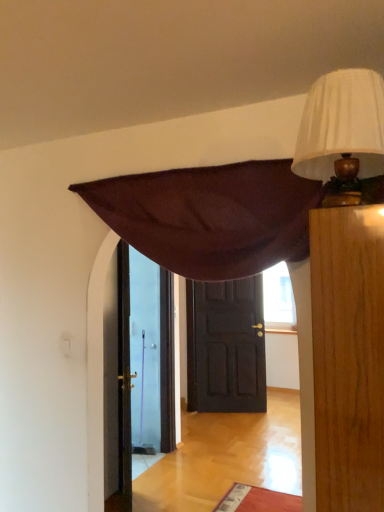
Find the location of a particular element. This screenshot has height=512, width=384. dark brown wooden door at center is located at coordinates (226, 346).

What do you see at coordinates (226, 346) in the screenshot? I see `dark brown wooden door at center` at bounding box center [226, 346].

The width and height of the screenshot is (384, 512). Describe the element at coordinates (344, 136) in the screenshot. I see `white pleated fabric lampshade at upper right` at that location.

The height and width of the screenshot is (512, 384). Identify the location of white pleated fabric lampshade at upper right. (344, 136).

Locate an element on the screen. Image resolution: width=384 pixels, height=512 pixels. dark brown wooden door at center is located at coordinates (226, 346).

Considering the relative positions of dark brown wooden door at center and white pleated fabric lampshade at upper right in the image provided, is dark brown wooden door at center to the left or to the right of white pleated fabric lampshade at upper right?

From the image, it's evident that dark brown wooden door at center is to the right of white pleated fabric lampshade at upper right.

Is dark brown wooden door at center in front of or behind white pleated fabric lampshade at upper right in the image?

In the image, dark brown wooden door at center appears behind white pleated fabric lampshade at upper right.

Between point (256, 352) and point (368, 157), which one is positioned behind?

The point (256, 352) is behind.

From the image's perspective, is dark brown wooden door at center above white pleated fabric lampshade at upper right?

No.

From a real-world perspective, between dark brown wooden door at center and white pleated fabric lampshade at upper right, who is vertically lower?

dark brown wooden door at center, from a real-world perspective.

Which object is wider, dark brown wooden door at center or white pleated fabric lampshade at upper right?

Wider between the two is white pleated fabric lampshade at upper right.

Considering the relative sizes of dark brown wooden door at center and white pleated fabric lampshade at upper right in the image provided, is dark brown wooden door at center taller than white pleated fabric lampshade at upper right?

Correct, dark brown wooden door at center is much taller as white pleated fabric lampshade at upper right.

Which of these two, dark brown wooden door at center or white pleated fabric lampshade at upper right, is smaller?

white pleated fabric lampshade at upper right.

Is dark brown wooden door at center outside of white pleated fabric lampshade at upper right?

Indeed, dark brown wooden door at center is completely outside white pleated fabric lampshade at upper right.

Is dark brown wooden door at center far away from white pleated fabric lampshade at upper right?

Absolutely, dark brown wooden door at center is distant from white pleated fabric lampshade at upper right.

Is dark brown wooden door at center positioned with its back to white pleated fabric lampshade at upper right?

No, white pleated fabric lampshade at upper right is not at the back of dark brown wooden door at center.

Identify the location of door below the white pleated fabric lampshade at upper right (from the image's perspective). (226, 346).

Is white pleated fabric lampshade at upper right at the right side of dark brown wooden door at center?

In fact, white pleated fabric lampshade at upper right is to the left of dark brown wooden door at center.

Looking at this image, relative to dark brown wooden door at center, is white pleated fabric lampshade at upper right in front or behind?

white pleated fabric lampshade at upper right is in front of dark brown wooden door at center.

Which point is more forward, (367, 130) or (198, 310)?

Positioned in front is point (367, 130).

From the image's perspective, which one is positioned lower, white pleated fabric lampshade at upper right or dark brown wooden door at center?

dark brown wooden door at center is shown below in the image.

From a real-world perspective, is white pleated fabric lampshade at upper right physically below dark brown wooden door at center?

No, from a real-world perspective, white pleated fabric lampshade at upper right is not beneath dark brown wooden door at center.

Looking at their sizes, would you say white pleated fabric lampshade at upper right is wider or thinner than dark brown wooden door at center?

white pleated fabric lampshade at upper right is wider than dark brown wooden door at center.

Between white pleated fabric lampshade at upper right and dark brown wooden door at center, which one has more height?

Standing taller between the two is dark brown wooden door at center.

Is white pleated fabric lampshade at upper right bigger than dark brown wooden door at center?

Actually, white pleated fabric lampshade at upper right might be smaller than dark brown wooden door at center.

Is white pleated fabric lampshade at upper right situated inside dark brown wooden door at center or outside?

The correct answer is: outside.

Is white pleated fabric lampshade at upper right far away from dark brown wooden door at center?

Yes.

Is white pleated fabric lampshade at upper right aimed at dark brown wooden door at center?

No, white pleated fabric lampshade at upper right is not turned towards dark brown wooden door at center.

The height and width of the screenshot is (512, 384). In order to click on door on the right of white pleated fabric lampshade at upper right in this screenshot , I will do `click(226, 346)`.

Find the location of a particular element. door behind the white pleated fabric lampshade at upper right is located at coordinates (226, 346).

At what (x,y) coordinates should I click in order to perform the action: click on lamp above the dark brown wooden door at center (from the image's perspective). Please return your answer as a coordinate pair (x, y). This screenshot has height=512, width=384. Looking at the image, I should click on (344, 136).